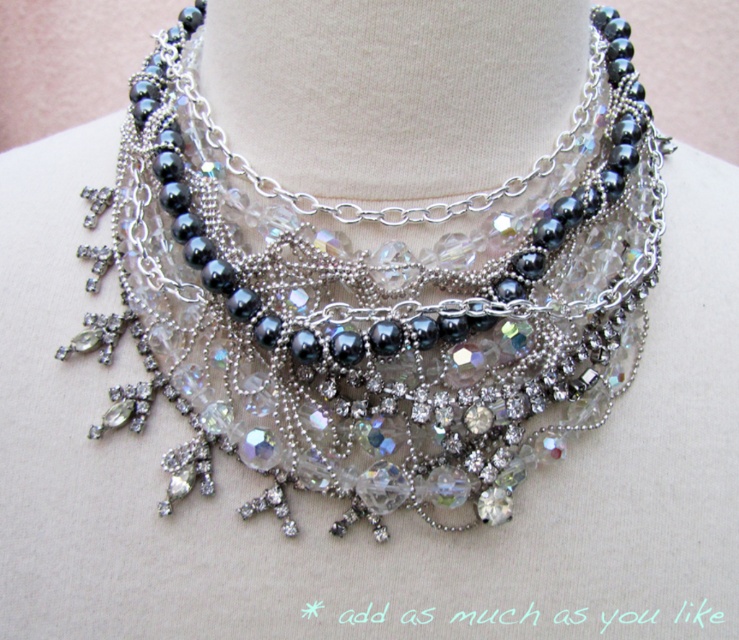
Question: Which object is closer to the camera taking this photo?

Choices:
 (A) clear crystal necklace at center
 (B) swarovski crystal necklace at center

Answer: (A)

Question: Is swarovski crystal necklace at center bigger than clear crystal necklace at center?

Choices:
 (A) no
 (B) yes

Answer: (B)

Question: Among these points, which one is nearest to the camera?

Choices:
 (A) (521, 70)
 (B) (422, 355)

Answer: (B)

Question: Is swarovski crystal necklace at center wider than clear crystal necklace at center?

Choices:
 (A) yes
 (B) no

Answer: (A)

Question: Among these points, which one is farthest from the camera?

Choices:
 (A) (406, 51)
 (B) (653, 138)

Answer: (B)

Question: Where is swarovski crystal necklace at center located in relation to clear crystal necklace at center in the image?

Choices:
 (A) right
 (B) left

Answer: (B)